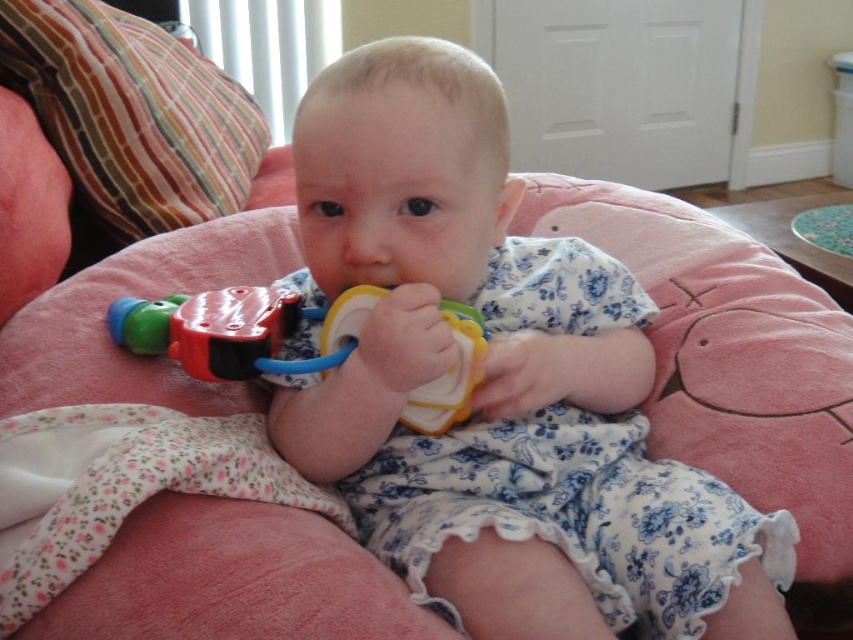
Question: Does striped fabric pillow at upper left appear under rubberized plastic rattle at center?

Choices:
 (A) yes
 (B) no

Answer: (B)

Question: From the image, what is the correct spatial relationship of striped fabric pillow at upper left in relation to rubberized plastic rattle at center?

Choices:
 (A) left
 (B) right

Answer: (A)

Question: Which point is closer to the camera?

Choices:
 (A) tap(62, 1)
 (B) tap(201, 330)

Answer: (B)

Question: Estimate the real-world distances between objects in this image. Which object is farther from the rubberized plastic rattle at center?

Choices:
 (A) striped fabric pillow at upper left
 (B) matte plastic toy at center

Answer: (A)

Question: Is matte plastic toy at center above striped fabric pillow at upper left?

Choices:
 (A) no
 (B) yes

Answer: (A)

Question: Which is farther from the striped fabric pillow at upper left?

Choices:
 (A) rubberized plastic rattle at center
 (B) matte plastic toy at center

Answer: (B)